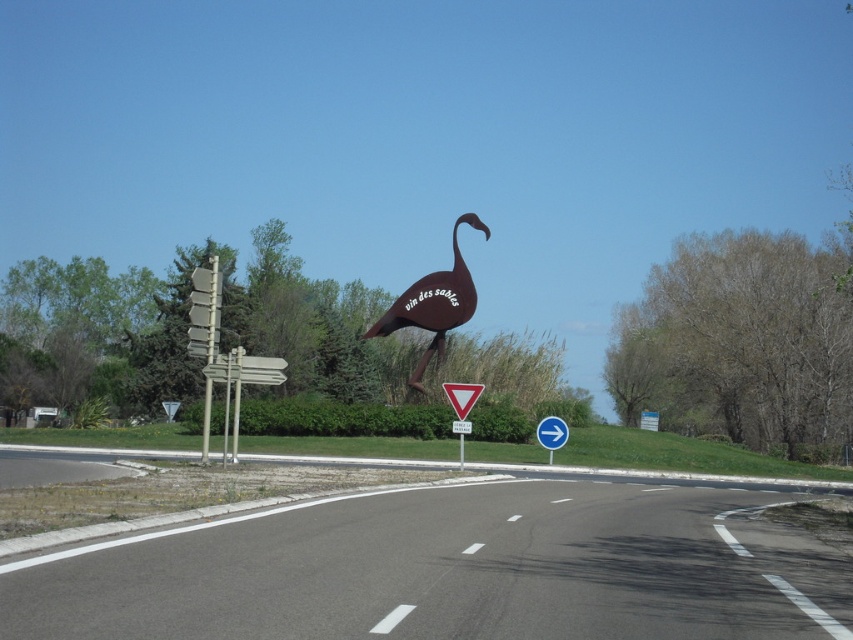
Question: Which point is closer to the camera taking this photo?

Choices:
 (A) (479, 384)
 (B) (291, 513)

Answer: (B)

Question: Considering the relative positions of brown matte sign at center and white plastic arrow at center right in the image provided, where is brown matte sign at center located with respect to white plastic arrow at center right?

Choices:
 (A) below
 (B) above

Answer: (B)

Question: Is brown matte sign at center positioned before brushed metal triangle at center?

Choices:
 (A) no
 (B) yes

Answer: (A)

Question: Among these points, which one is farthest from the camera?

Choices:
 (A) (454, 394)
 (B) (537, 544)
 (C) (465, 426)

Answer: (C)

Question: Which object is the farthest from the metal triangular sign at center?

Choices:
 (A) white plastic arrow at center right
 (B) black asphalt road at lower center
 (C) brushed metal triangle at center
 (D) brown matte sign at center

Answer: (B)

Question: Can you confirm if white plastic arrow at center right is smaller than brushed metal triangle at center?

Choices:
 (A) yes
 (B) no

Answer: (A)